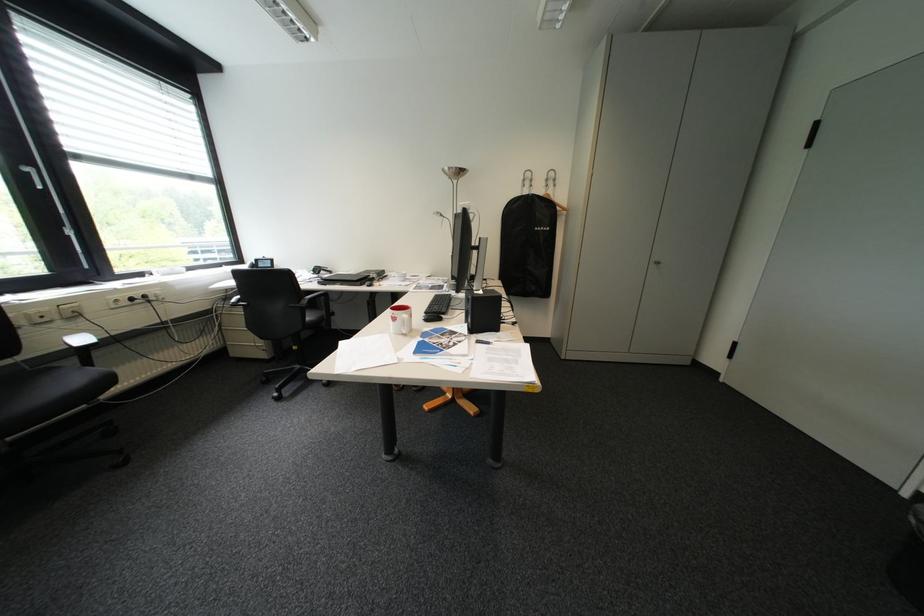
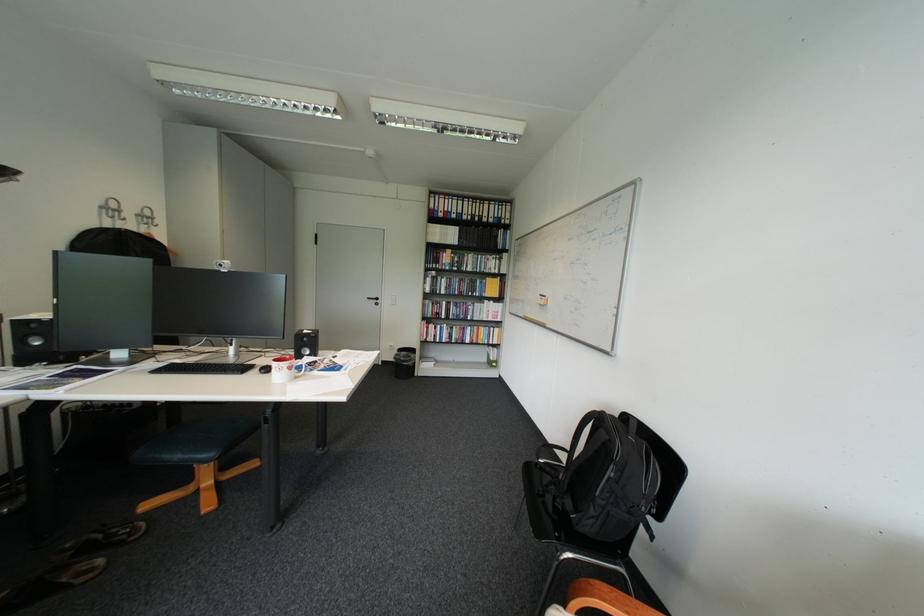
Where in the second image is the point corresponding to pixel 543 187 from the first image?

(137, 220)